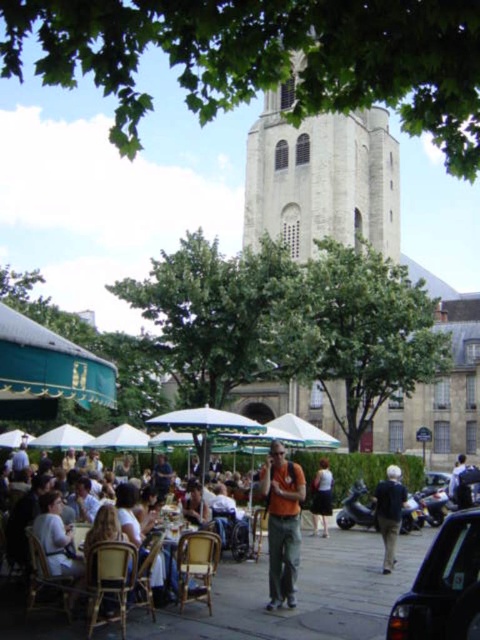
Question: Estimate the real-world distances between objects in this image. Which object is farther from the white cotton shirt at center?

Choices:
 (A) white fabric umbrella at center
 (B) wooden table at center
 (C) orange fabric shirt at center

Answer: (B)

Question: Among these points, which one is nearest to the camera?

Choices:
 (A) (355, 93)
 (B) (175, 548)
 (C) (360, 413)

Answer: (A)

Question: Does black glossy car at lower right appear over green canvas canopy at left?

Choices:
 (A) no
 (B) yes

Answer: (A)

Question: Which point is farther to the camera?

Choices:
 (A) (433, 80)
 (B) (330, 509)
 (C) (23, 413)
 (D) (328, 300)

Answer: (D)

Question: Is orange fabric shirt at center to the left of white fabric umbrella at center from the viewer's perspective?

Choices:
 (A) no
 (B) yes

Answer: (A)

Question: Is green canvas canopy at left wider than orange fabric shirt at center?

Choices:
 (A) no
 (B) yes

Answer: (B)